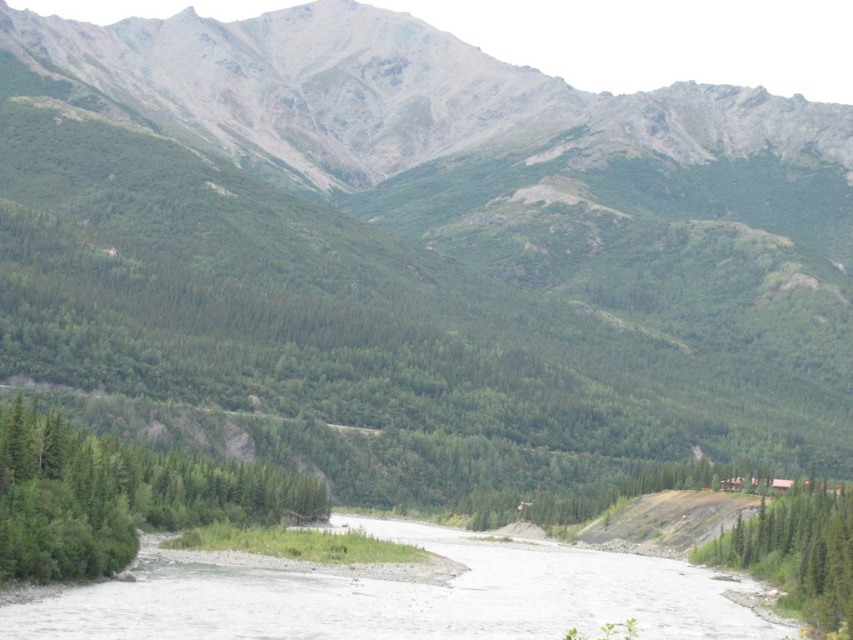
Question: Estimate the real-world distances between objects in this image. Which object is farther from the green matte tree at lower left?

Choices:
 (A) white gravel river at lower center
 (B) green textured tree at lower right

Answer: (B)

Question: Which point is farther to the camera?

Choices:
 (A) (838, 572)
 (B) (260, 604)

Answer: (A)

Question: Can you confirm if white gravel river at lower center is positioned to the left of green matte tree at lower left?

Choices:
 (A) no
 (B) yes

Answer: (A)

Question: Does white gravel river at lower center have a greater width compared to green matte tree at lower left?

Choices:
 (A) yes
 (B) no

Answer: (A)

Question: Is white gravel river at lower center positioned at the back of green matte tree at lower left?

Choices:
 (A) no
 (B) yes

Answer: (A)

Question: Estimate the real-world distances between objects in this image. Which object is farther from the green textured tree at lower right?

Choices:
 (A) green matte tree at lower left
 (B) white gravel river at lower center

Answer: (A)